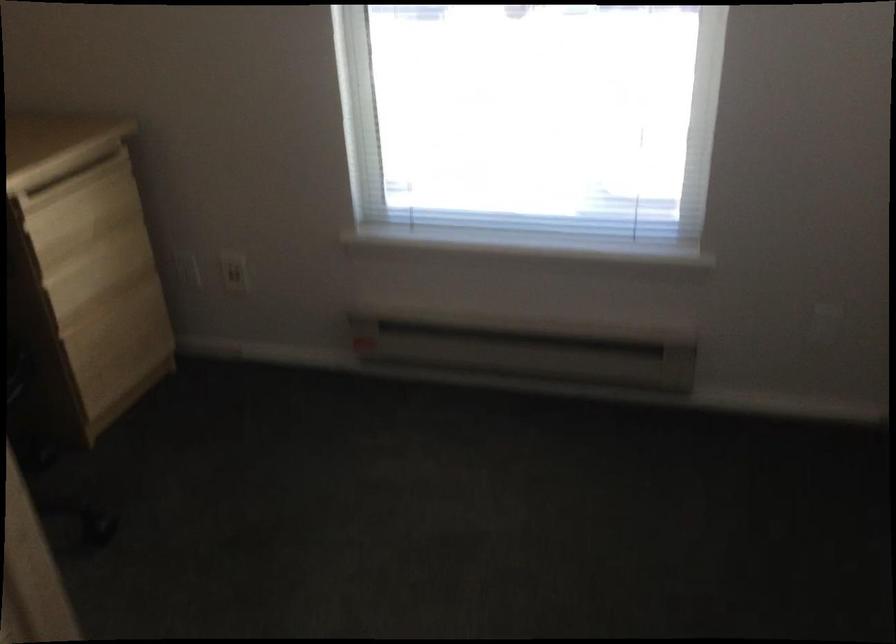
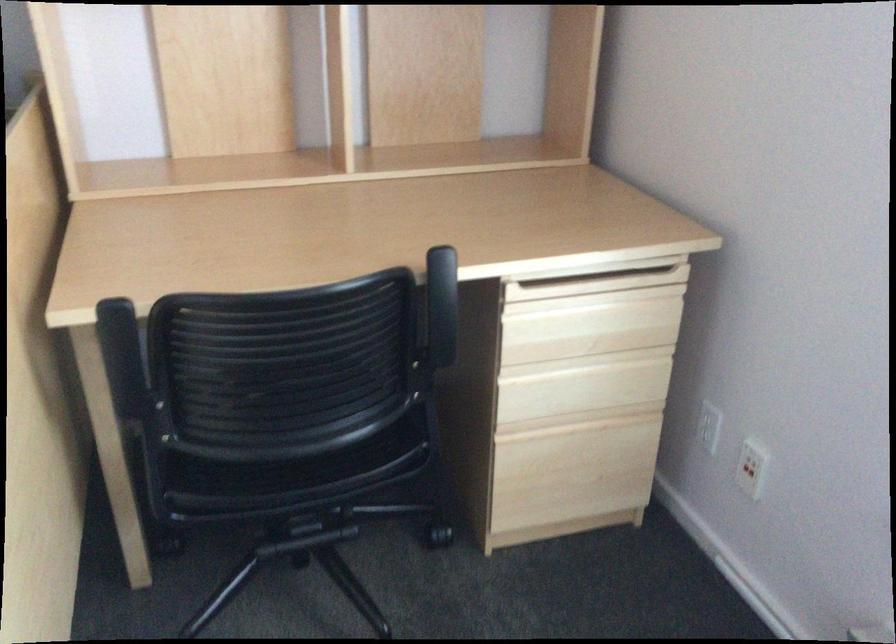
Find the pixel in the second image that matches point 237,274 in the first image.

(747, 469)